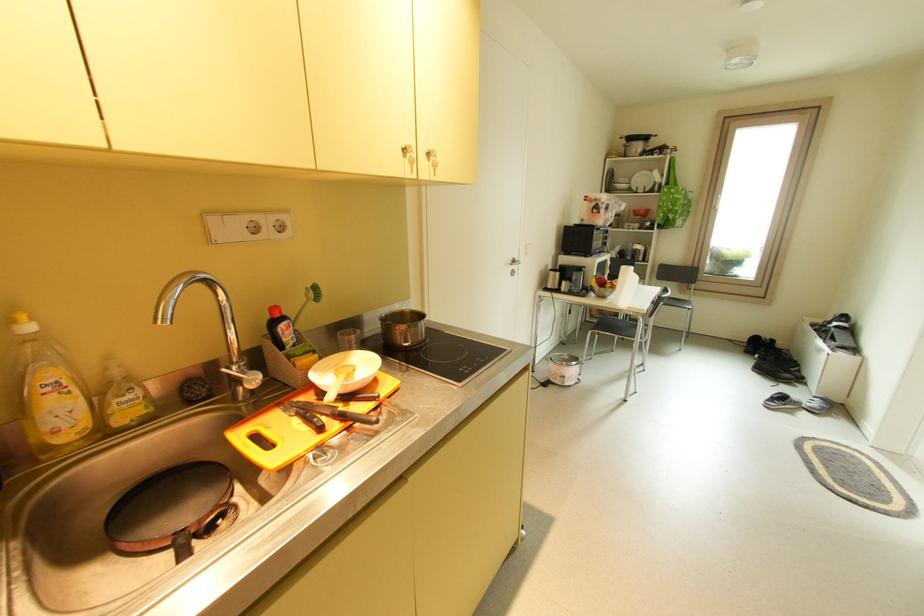
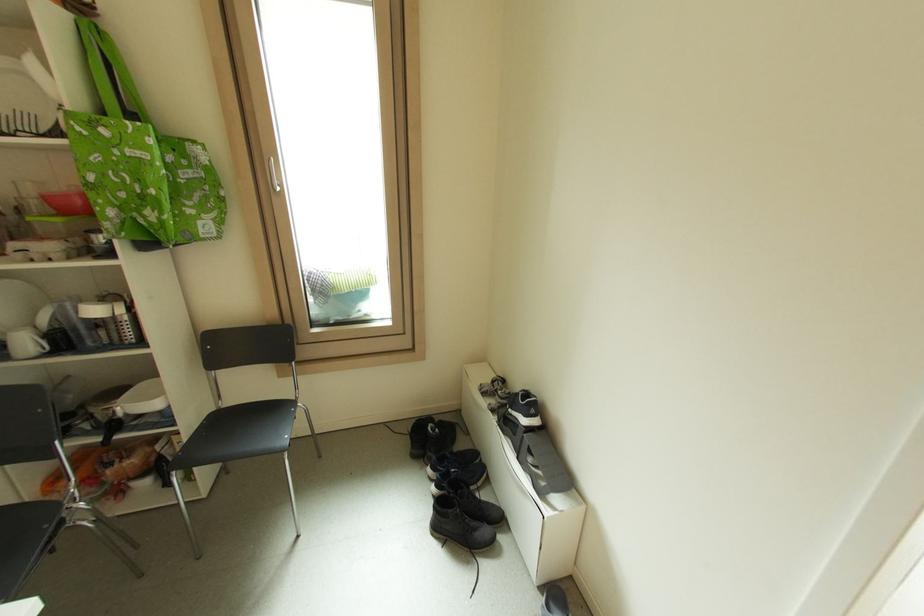
The point at (794, 377) is marked in the first image. Where is the corresponding point in the second image?

(490, 532)